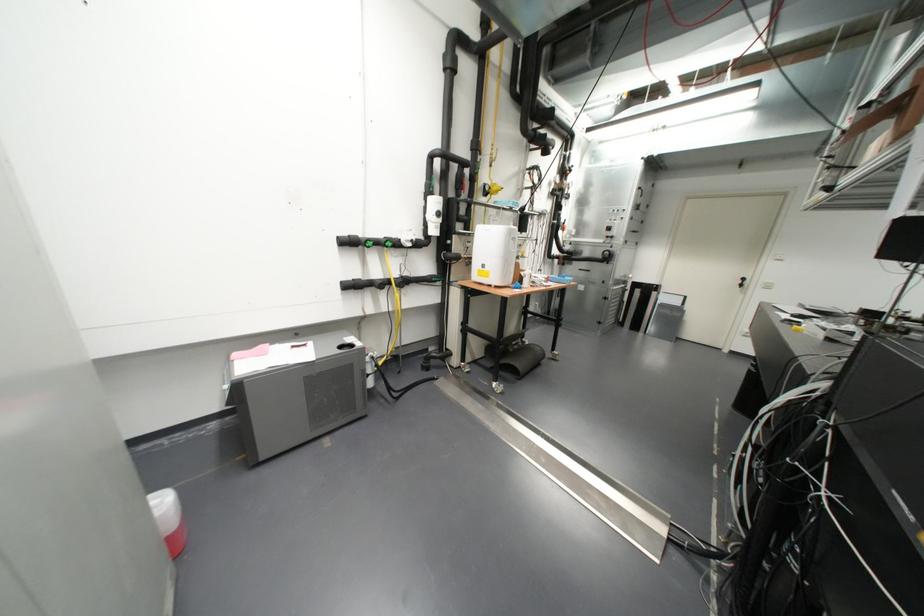
Where would you turn the red valve handle? Please return your answer as a coordinate pair (x, y).

(168, 519)